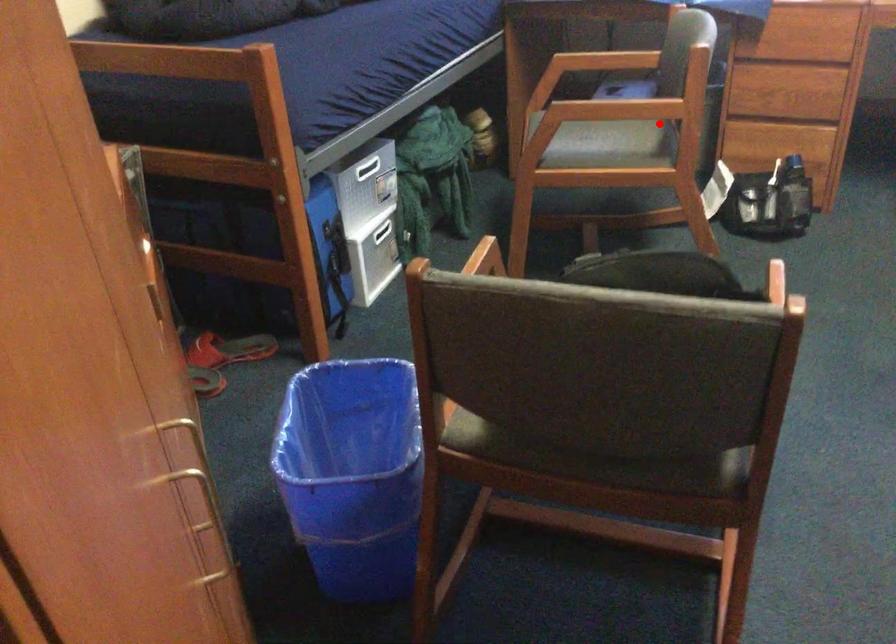
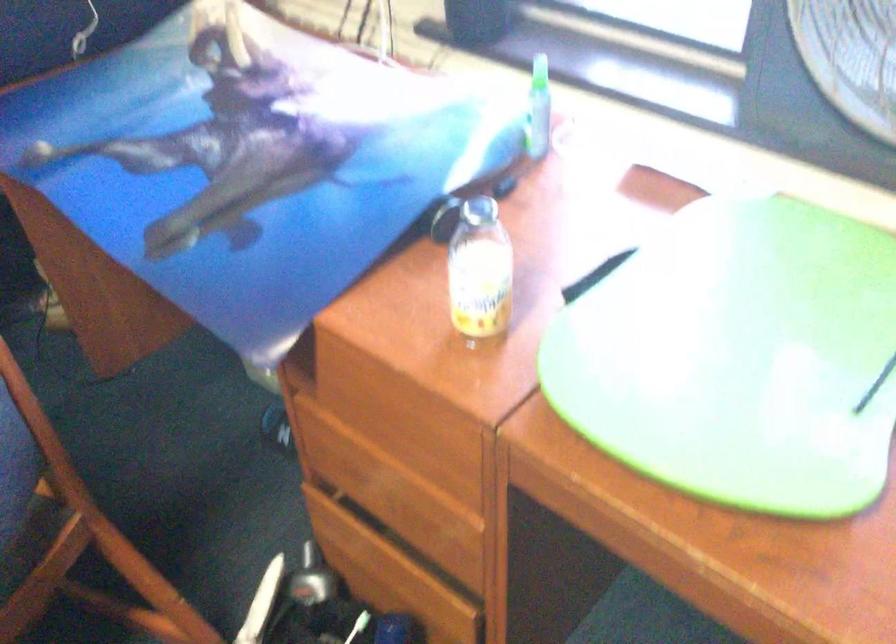
Question: I am providing you with two images of the same scene from different viewpoints. Given a red point in image1, look at the same physical point in image2. Is it:

Choices:
 (A) Closer to the viewpoint
 (B) Farther from the viewpoint

Answer: (A)